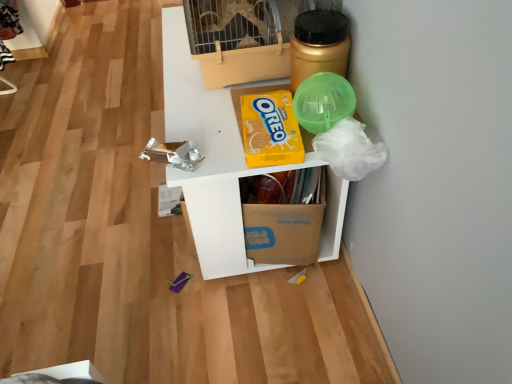
You are a GUI agent. You are given a task and a screenshot of the screen. Output one action in this format:
    pyautogui.click(x=<x>, y=<y>)
    Task: Click on the vacant region to the left of brown cardboard box at center
    This screenshot has width=512, height=384.
    Given the screenshot: What is the action you would take?
    pyautogui.click(x=172, y=264)